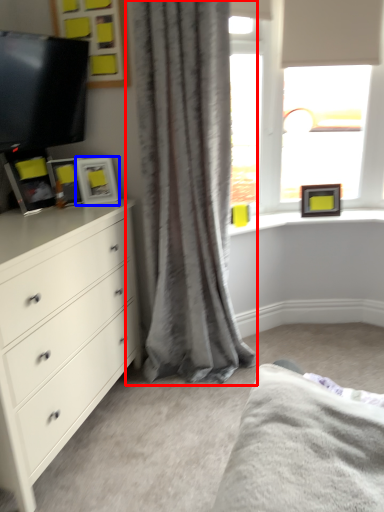
Question: Which object appears closest to the camera in this image, curtain (highlighted by a red box) or picture frame (highlighted by a blue box)?

Choices:
 (A) curtain
 (B) picture frame

Answer: (A)